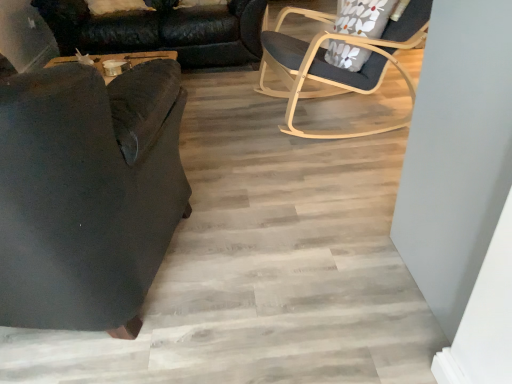
Question: Can you confirm if black leather couch at left is smaller than dark fabric chair at left, which ranks as the 2th chair in right-to-left order?

Choices:
 (A) no
 (B) yes

Answer: (A)

Question: From a real-world perspective, is black leather couch at left beneath dark fabric chair at left, positioned as the first chair in left-to-right order?

Choices:
 (A) yes
 (B) no

Answer: (A)

Question: Does black leather couch at left appear on the left side of dark fabric chair at left, positioned as the first chair in left-to-right order?

Choices:
 (A) yes
 (B) no

Answer: (A)

Question: Considering the relative sizes of black leather couch at left and dark fabric chair at left, which is counted as the 2th chair, starting from the back, in the image provided, is black leather couch at left shorter than dark fabric chair at left, which is counted as the 2th chair, starting from the back,?

Choices:
 (A) no
 (B) yes

Answer: (B)

Question: Is dark fabric chair at left, arranged as the 1th chair when viewed from the front, at the back of black leather couch at left?

Choices:
 (A) yes
 (B) no

Answer: (B)

Question: From the image's perspective, is floral fabric pillow at upper right positioned above or below dark fabric chair at left, arranged as the 1th chair when viewed from the front?

Choices:
 (A) below
 (B) above

Answer: (B)

Question: Is point (367, 28) closer or farther from the camera than point (143, 200)?

Choices:
 (A) farther
 (B) closer

Answer: (A)

Question: Considering the positions of floral fabric pillow at upper right and dark fabric chair at left, positioned as the first chair in left-to-right order, in the image, is floral fabric pillow at upper right wider or thinner than dark fabric chair at left, positioned as the first chair in left-to-right order,?

Choices:
 (A) thin
 (B) wide

Answer: (A)

Question: Choose the correct answer: Is floral fabric pillow at upper right inside dark fabric chair at left, arranged as the 1th chair when viewed from the front, or outside it?

Choices:
 (A) outside
 (B) inside

Answer: (A)

Question: Looking at the image, does dark fabric chair at left, which ranks as the 2th chair in right-to-left order, seem bigger or smaller compared to floral fabric pillow at upper right?

Choices:
 (A) big
 (B) small

Answer: (A)

Question: From the image's perspective, is dark fabric chair at left, which is counted as the 2th chair, starting from the back, positioned above or below floral fabric pillow at upper right?

Choices:
 (A) above
 (B) below

Answer: (B)

Question: Visually, is dark fabric chair at left, arranged as the 1th chair when viewed from the front, positioned to the left or to the right of floral fabric pillow at upper right?

Choices:
 (A) right
 (B) left

Answer: (B)

Question: Considering the positions of dark fabric chair at left, positioned as the first chair in left-to-right order, and floral fabric pillow at upper right in the image, is dark fabric chair at left, positioned as the first chair in left-to-right order, taller or shorter than floral fabric pillow at upper right?

Choices:
 (A) tall
 (B) short

Answer: (A)

Question: Is black leather couch at left in front of or behind light wood/transparentobject at upper right, arranged as the first chair when viewed from the right, in the image?

Choices:
 (A) front
 (B) behind

Answer: (B)

Question: From the image's perspective, is black leather couch at left located above or below light wood/transparentobject at upper right, arranged as the 1th chair when viewed from the back?

Choices:
 (A) below
 (B) above

Answer: (B)